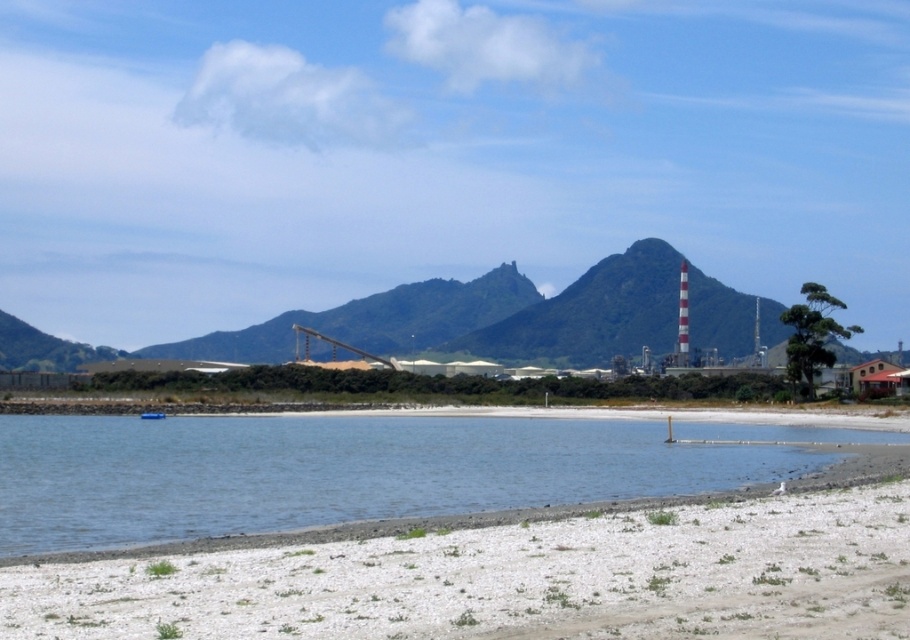
Is white gravelly sand at lower center below blue plastic boat at lower left?

Actually, white gravelly sand at lower center is above blue plastic boat at lower left.

Between white gravelly sand at lower center and blue plastic boat at lower left, which one has less height?

Standing shorter between the two is blue plastic boat at lower left.

The width and height of the screenshot is (910, 640). Describe the element at coordinates (513, 579) in the screenshot. I see `white gravelly sand at lower center` at that location.

Locate an element on the screen. The height and width of the screenshot is (640, 910). white gravelly sand at lower center is located at coordinates (513, 579).

Who is more forward, (23, 499) or (157, 412)?

Point (23, 499) is more forward.

Is blue water at lower left to the left of blue plastic boat at lower left from the viewer's perspective?

No, blue water at lower left is not to the left of blue plastic boat at lower left.

Does point (590, 461) lie behind point (155, 417)?

No, it is in front of (155, 417).

You are a GUI agent. You are given a task and a screenshot of the screen. Output one action in this format:
    pyautogui.click(x=<x>, y=<y>)
    Task: Click on the blue water at lower left
    This screenshot has width=910, height=640.
    Given the screenshot: What is the action you would take?
    pyautogui.click(x=355, y=468)

Who is more forward, (588, 572) or (750, 460)?

Point (588, 572)

Is point (123, 611) in front of point (7, 440)?

Yes, point (123, 611) is in front of point (7, 440).

I want to click on white gravelly sand at lower center, so click(513, 579).